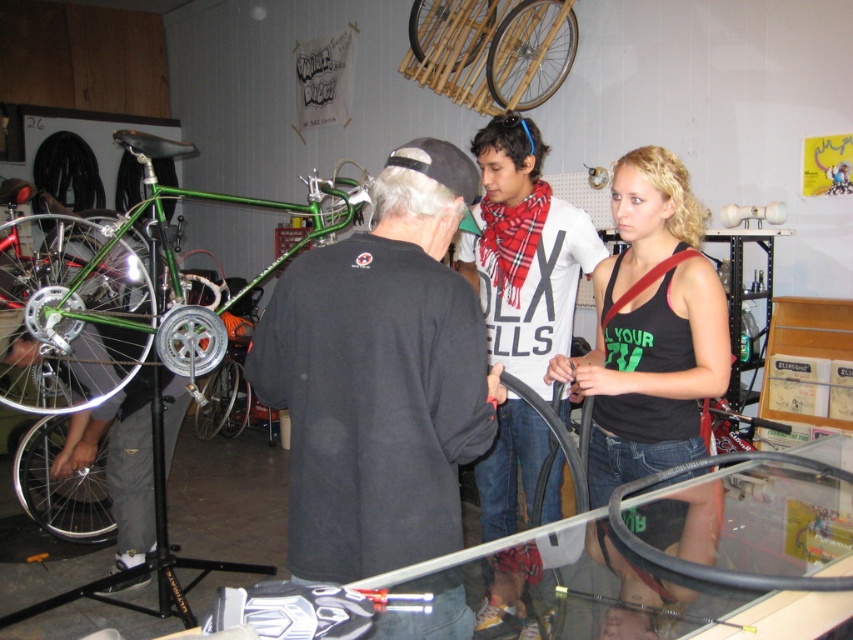
Who is positioned more to the left, black tank top at center or red plaid scarf at center?

Positioned to the left is red plaid scarf at center.

Who is more forward, (675,426) or (502,269)?

Positioned in front is point (675,426).

I want to click on black tank top at center, so click(650, 330).

From the picture: Can you confirm if dark gray sweatshirt at center is positioned below green matte bicycle at upper center?

Correct, dark gray sweatshirt at center is located below green matte bicycle at upper center.

Is dark gray sweatshirt at center smaller than green matte bicycle at upper center?

Yes.

Does point (392, 285) come farther from viewer compared to point (532, 76)?

That is False.

At what (x,y) coordinates should I click in order to perform the action: click on dark gray sweatshirt at center. Please return your answer as a coordinate pair (x, y). This screenshot has width=853, height=640. Looking at the image, I should click on (380, 376).

Does red plaid scarf at center have a larger size compared to green matte bicycle at upper center?

Actually, red plaid scarf at center might be smaller than green matte bicycle at upper center.

Does red plaid scarf at center appear on the left side of green matte bicycle at upper center?

Incorrect, red plaid scarf at center is not on the left side of green matte bicycle at upper center.

Is point (503, 128) closer to camera compared to point (509, 97)?

Yes, it is.

This screenshot has width=853, height=640. I want to click on red plaid scarf at center, so click(524, 252).